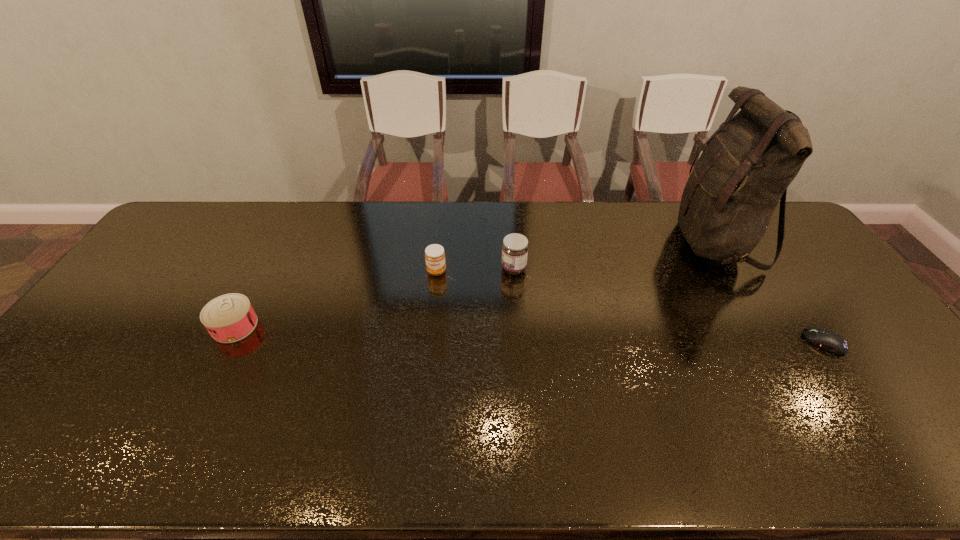
Find the location of `object situated at the far right corner`. object situated at the far right corner is located at coordinates (745, 169).

In the image, there is a desktop. Identify the location of vacant space at the far edge. (524, 203).

In order to click on free space at the near edge of the desktop in this screenshot , I will do `click(547, 450)`.

You are a GUI agent. You are given a task and a screenshot of the screen. Output one action in this format:
    pyautogui.click(x=<x>, y=<y>)
    Task: Click on the vacant region at the left edge of the desktop
    The height and width of the screenshot is (540, 960).
    Given the screenshot: What is the action you would take?
    pyautogui.click(x=111, y=360)

The image size is (960, 540). Identify the location of free spot at the right edge of the desktop. click(838, 288).

Locate an element on the screen. vacant space that is in between the fourth tallest object and the computer equipment is located at coordinates [x=529, y=334].

This screenshot has width=960, height=540. I want to click on free area in between the tallest object and the taller jam, so click(614, 255).

Identify the location of free spot between the second tallest object and the shortest object. (669, 305).

Locate an element on the screen. The image size is (960, 540). vacant space in between the backpack and the right jam is located at coordinates (614, 255).

Identify the location of free space between the computer equipment and the third tallest object. (631, 307).